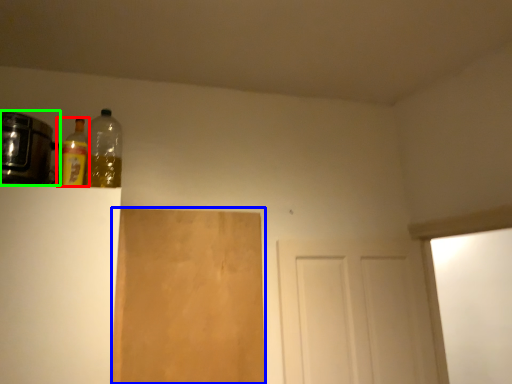
Question: Which object is positioned farthest from bottle (highlighted by a red box)? Select from plywood (highlighted by a blue box) and appliance (highlighted by a green box).

Choices:
 (A) plywood
 (B) appliance

Answer: (A)